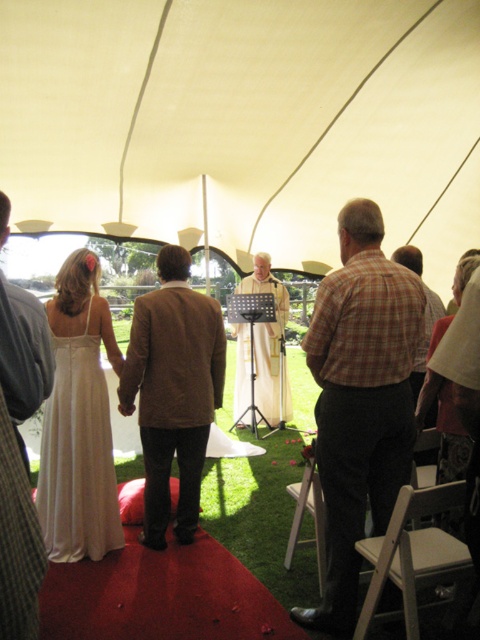
Question: Among these points, which one is nearest to the camera?

Choices:
 (A) (432, 300)
 (B) (379, 248)
 (C) (111, 496)

Answer: (B)

Question: Which of these objects is positioned closest to the white silk dress at center?

Choices:
 (A) white fabric canopy at center
 (B) brown wool coat at center
 (C) plaid shirt at center

Answer: (A)

Question: Is white satin dress at left bigger than plaid fabric shirt at center?

Choices:
 (A) no
 (B) yes

Answer: (A)

Question: Based on their relative distances, which object is nearer to the plaid shirt at center?

Choices:
 (A) white satin dress at left
 (B) brown wool coat at center

Answer: (B)

Question: Does plaid shirt at center appear on the left side of brown wool coat at center?

Choices:
 (A) no
 (B) yes

Answer: (A)

Question: Can you confirm if plaid shirt at center is smaller than brown woolen suit at center?

Choices:
 (A) no
 (B) yes

Answer: (B)